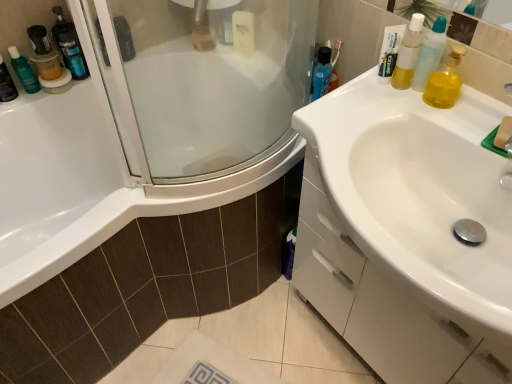
Identify the location of free spot in front of yellow translucent liquid at upper right, acting as the first toiletry starting from the right. This screenshot has width=512, height=384. (438, 119).